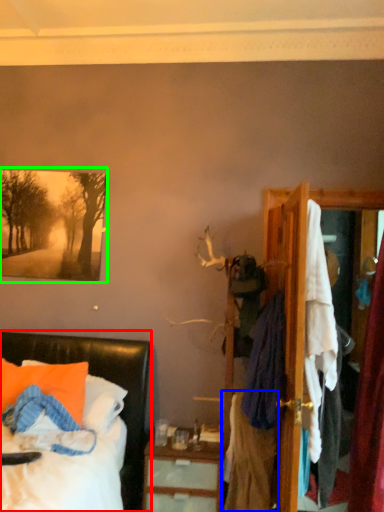
Question: Estimate the real-world distances between objects in this image. Which object is farther from bed (highlighted by a red box), clothing (highlighted by a blue box) or picture frame (highlighted by a green box)?

Choices:
 (A) clothing
 (B) picture frame

Answer: (A)